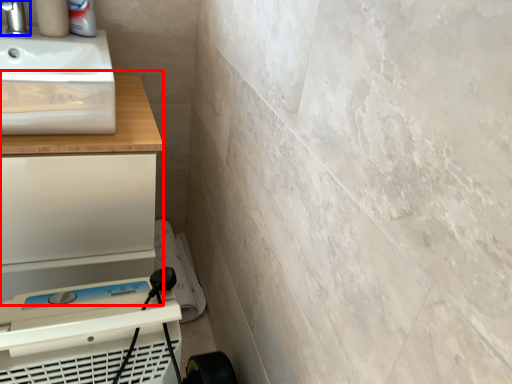
Question: Which object appears closest to the camera in this image, counter (highlighted by a red box) or tap (highlighted by a blue box)?

Choices:
 (A) counter
 (B) tap

Answer: (A)